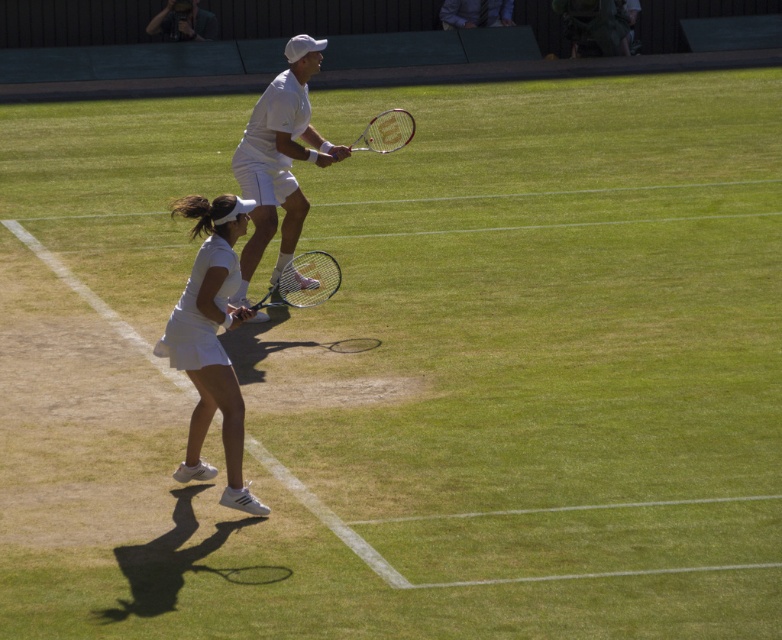
Question: Can you confirm if blue metallic tennis racket at center is positioned to the right of metallic silver tennis racket at center?

Choices:
 (A) no
 (B) yes

Answer: (A)

Question: Can you confirm if blue metallic tennis racket at center is positioned to the right of metallic silver tennis racket at center?

Choices:
 (A) yes
 (B) no

Answer: (B)

Question: Based on their relative distances, which object is nearer to the metallic silver tennis racket at center?

Choices:
 (A) blue metallic tennis racket at center
 (B) white matte tennis skirt at lower left

Answer: (A)

Question: Does blue metallic tennis racket at center come behind metallic silver tennis racket at center?

Choices:
 (A) no
 (B) yes

Answer: (A)

Question: Which point is farther from the camera taking this photo?

Choices:
 (A) (350, 147)
 (B) (314, 276)
 (C) (221, 371)
 (D) (310, 67)

Answer: (A)

Question: Based on their relative distances, which object is nearer to the metallic silver tennis racket at center?

Choices:
 (A) blue metallic tennis racket at center
 (B) white matte tennis skirt at lower left
 (C) white matte tennis racket at center

Answer: (C)